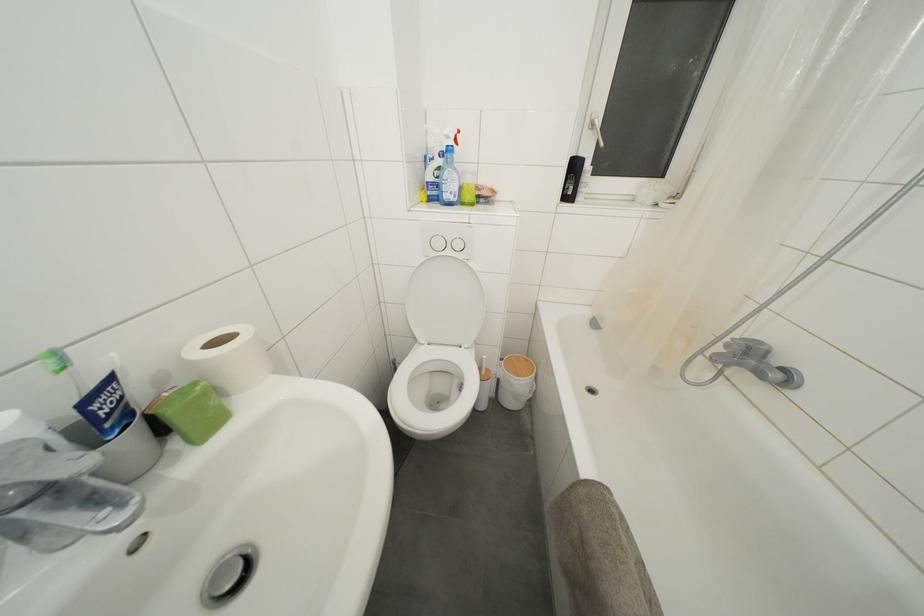
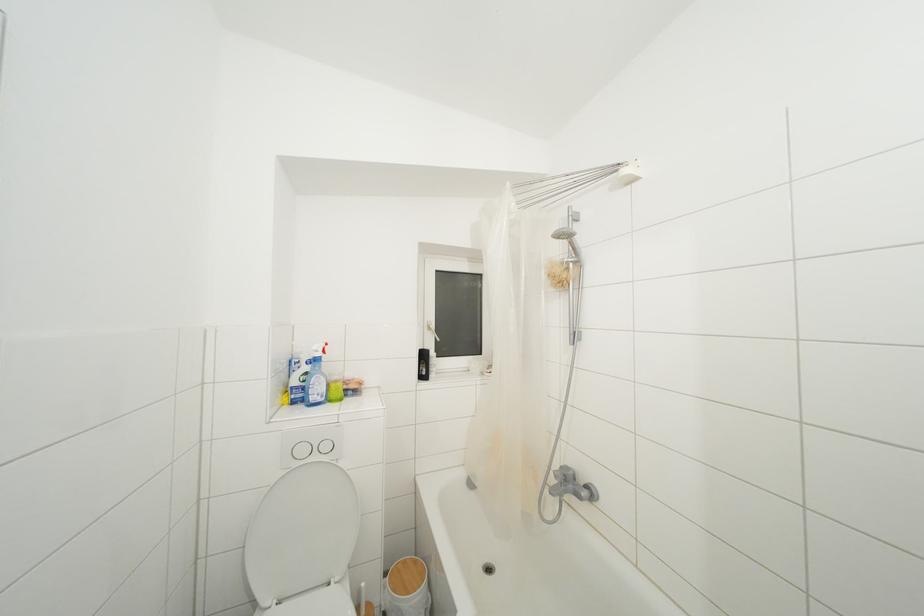
Where in the second image is the point corresponding to pixel 578 172 from the first image?

(428, 361)